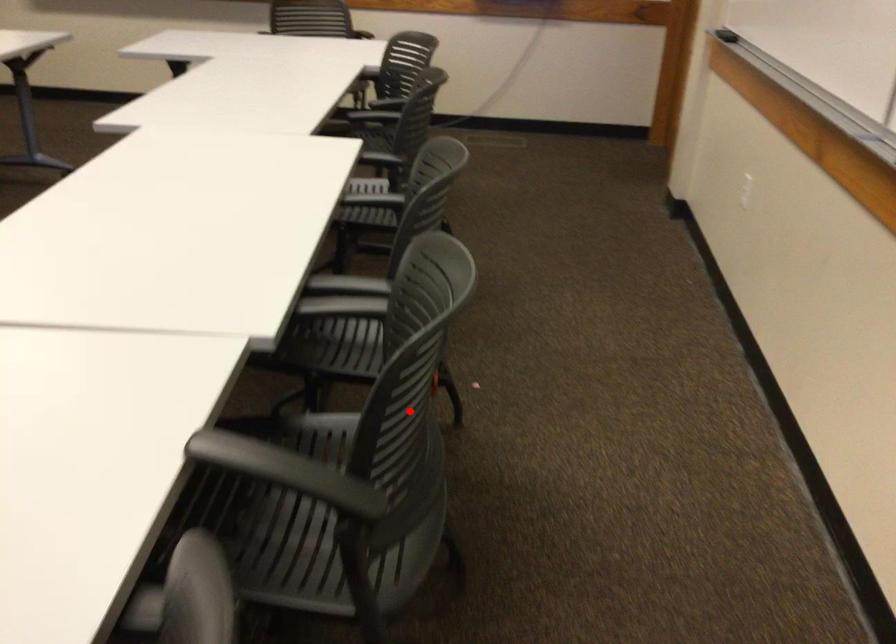
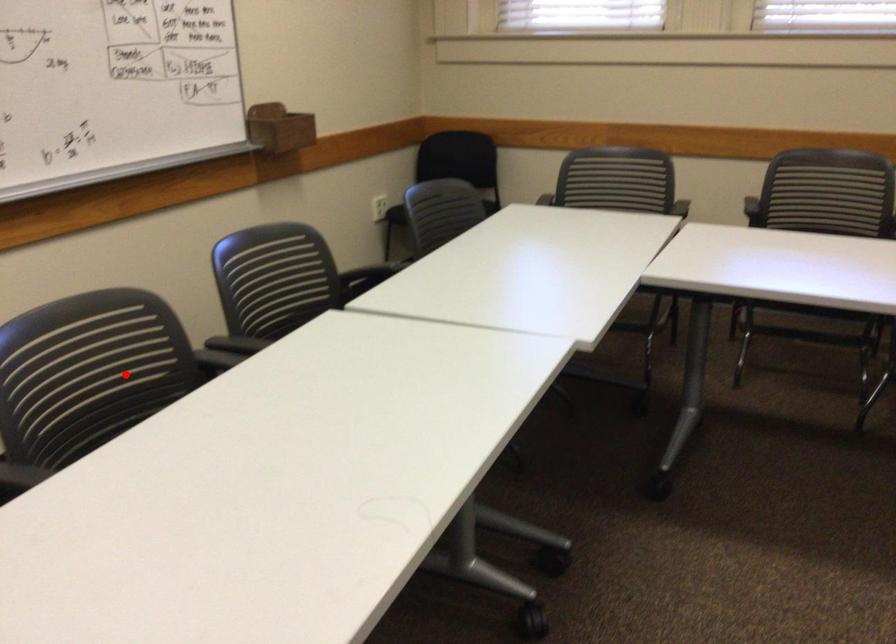
I am providing you with two images of the same scene from different viewpoints. A red point is marked on the first image and another point is marked on the second image. Is the marked point in image1 the same physical position as the marked point in image2?

No